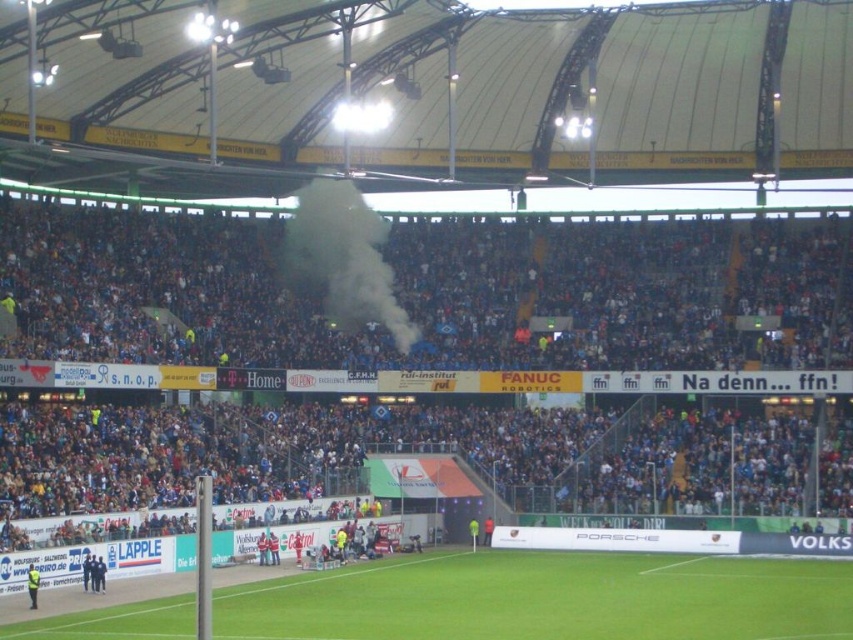
You are a drone operator tasked with capturing aerial footage of the blue fabric crowd at upper center and the green grass football field at center. The drone has a maximum operational range of 50 feet. Can the drone safely capture footage of both objects without exceeding its range?

The blue fabric crowd at upper center is 51.24 feet away from the green grass football field at center. Since the drone has a maximum operational range of 50 feet, it cannot safely capture footage of both objects without exceeding its range.

You are a drone operator assigned to capture aerial footage of the football game. Your task is to ensure the camera focuses on the green grass football field at center. Given that the camera is currently positioned at point (547, 598), will it be pointing towards the green grass football field at center?

Yes, the camera positioned at point (547, 598) is directly pointing towards the green grass football field at center as that is exactly where the point is located.

In the scene shown: You are a photographer positioned at the camera. You want to capture a closeup shot of the blue fabric crowd at upper center. Given that your telephoto lens can focus on subjects up to 70 meters away, will you be able to get a clear closeup?

The blue fabric crowd at upper center and the camera are 74.12 meters apart. Since the telephoto lens can only focus up to 70 meters, you will not be able to get a clear closeup of the blue fabric crowd at upper center.